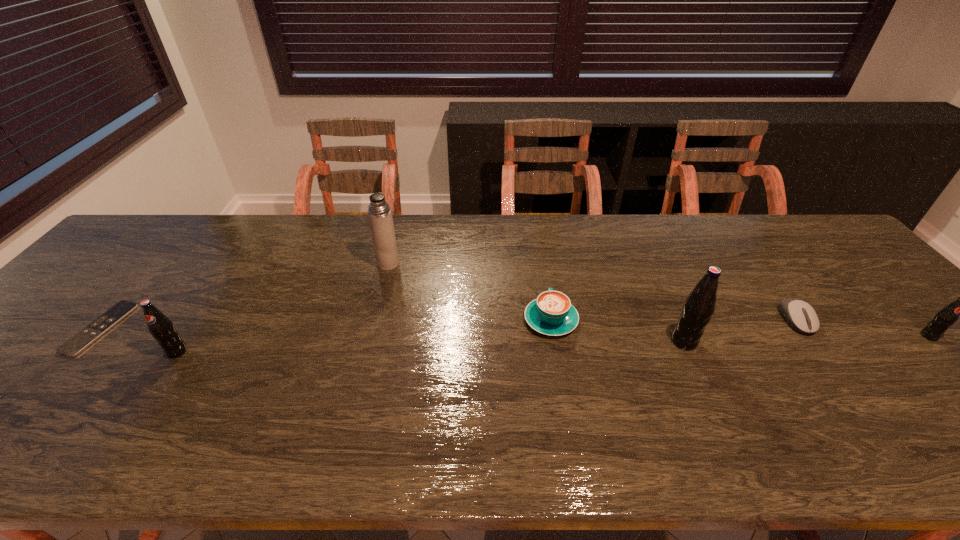
If the aim is uniform spacing by inserting an additional pop_(soda) among them, please point to a vacant space for this new pop_(soda). Please provide its 2D coordinates. Your answer should be formatted as a tuple, i.e. [(x, y)], where the tuple contains the x and y coordinates of a point satisfying the conditions above.

[(434, 346)]